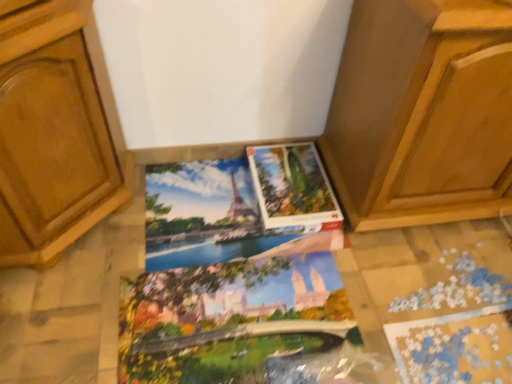
Where is `free space in front of matte paper coloring book at center, placed as the first coloring book when sorted from top to bottom`? This screenshot has width=512, height=384. free space in front of matte paper coloring book at center, placed as the first coloring book when sorted from top to bottom is located at coordinates (208, 315).